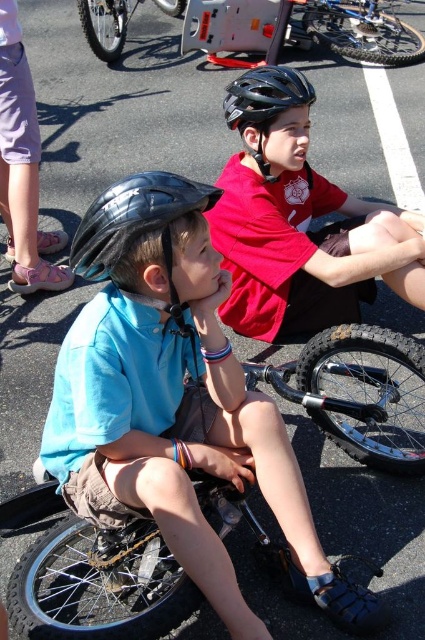
You are standing 10 feet away from the scene. You want to pick up the matte black helmet at center. Can you reach it without moving your feet?

The matte black helmet at center is 7.28 feet away from the viewer. Since you are standing 10 feet away, it is 2.72 feet closer. However, typical human reaching distance without moving feet is about 2 feet. Therefore, you cannot reach it without moving closer.